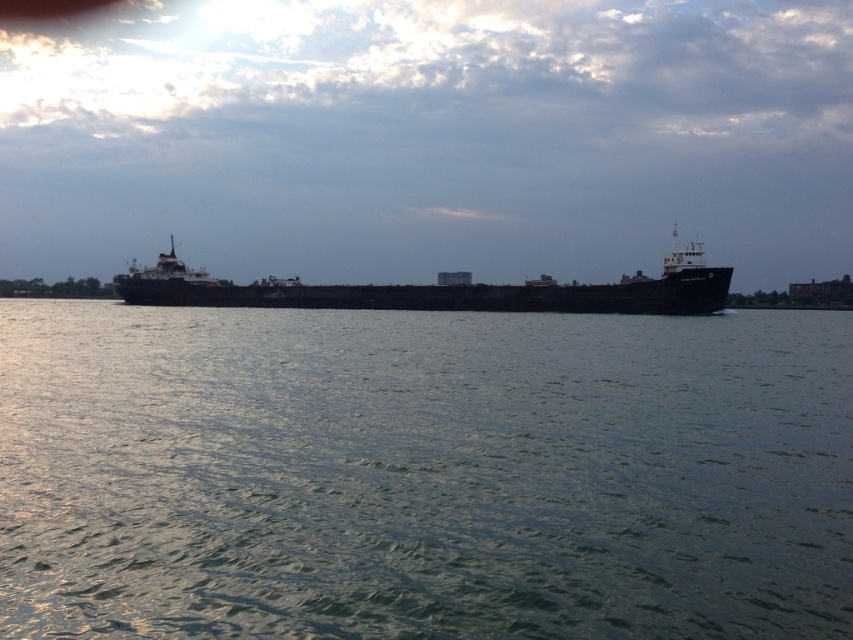
You are a marine biologist observing the scene from a nearby island. You notice the green water at center and the black matte ship at center. Which object takes up more space in the image?

The black matte ship at center takes up more space in the image because the green water at center has a smaller size compared to it.

Looking at this image, you are a sailor on the cargo ship and you want to drop an anchor into the green water at center. The coordinates of the green water at center are given as point (422, 474). If your current position is at point 0.5, 0.5, which direction should you move to reach the green water at center?

The green water at center is located at point (422, 474). Since your current position is at 0.5, 0.5, you need to move northeast to reach the green water at center because the x coordinate increases from 0.5 to 0.742 and the y coordinate decreases from 0.5 to 0.496.

You are standing on the deck of the cargo ship and want to take a photo of the point at coordinates point (743, 413). If your camera has a maximum range of 25 meters, will you be able to capture the point in your photo?

The point at coordinates point (743, 413) is 23.87 meters away from the camera, which is within the camera maximum range of 25 meters. Therefore, the camera can capture the point in the photo.